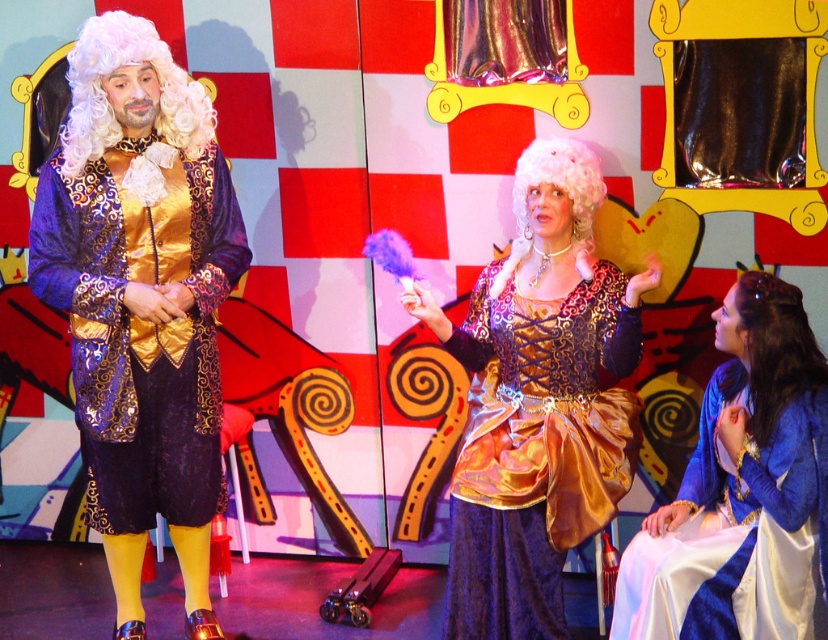
You are a costume designer observing the performers on stage. You need to adjust the placement of the dark brown silky wig at lower right and the white curly wig at center. Based on their current positions, which wig is located to the right of the other?

The dark brown silky wig at lower right is positioned on the right side of white curly wig at center.

You are an actor in a play and need to place a golden crown on the satin blue dress at center located at point [742,488]. Is this position visible to the audience seated in the front row?

The satin blue dress at center is located at point [742,488], which is visible to the audience in the front row since it is positioned at the center of the stage.

You are an actor backstage preparing for your performance. You see the shiny gold vest at center and the white curly wig at center. Which item should you put on first according to the current arrangement?

The shiny gold vest at center is positioned under the white curly wig at center, so you should put on the shiny gold vest at center first before placing the white curly wig at center on your head.